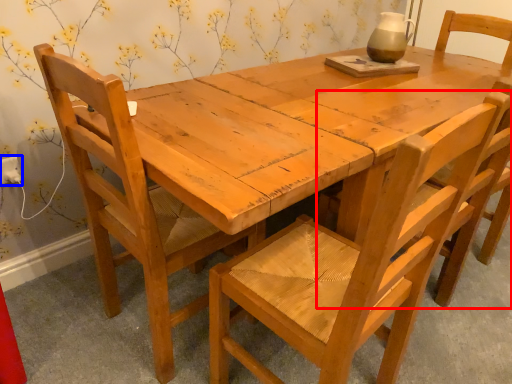
Question: Which object appears farthest to the camera in this image, chair (highlighted by a red box) or electric outlet (highlighted by a blue box)?

Choices:
 (A) chair
 (B) electric outlet

Answer: (B)